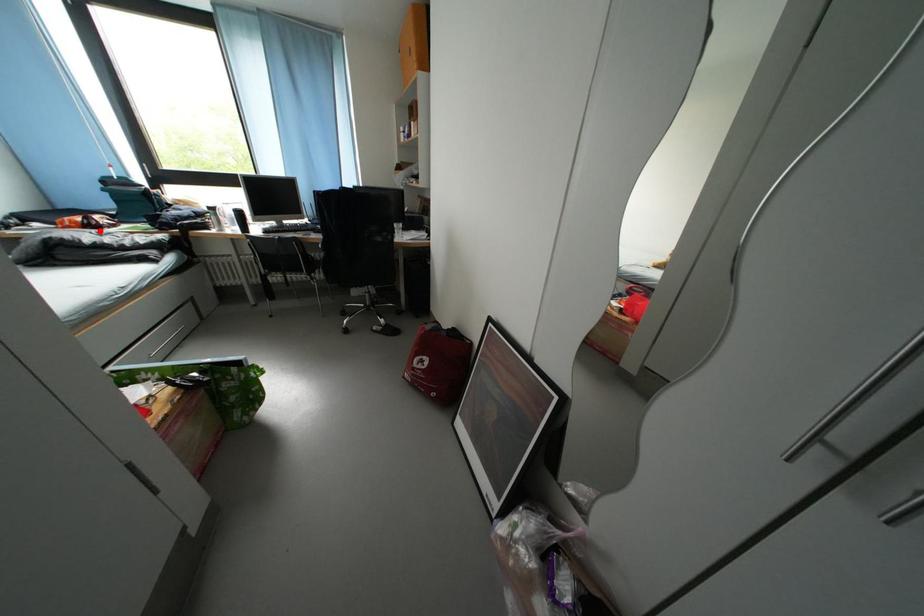
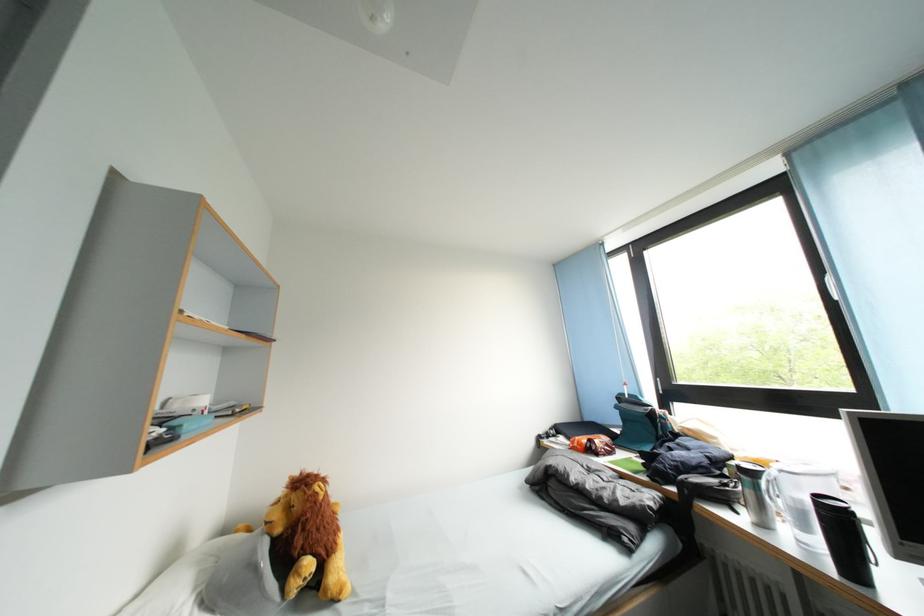
Find the pixel in the second image that matches the highlighted location in the first image.

(600, 455)